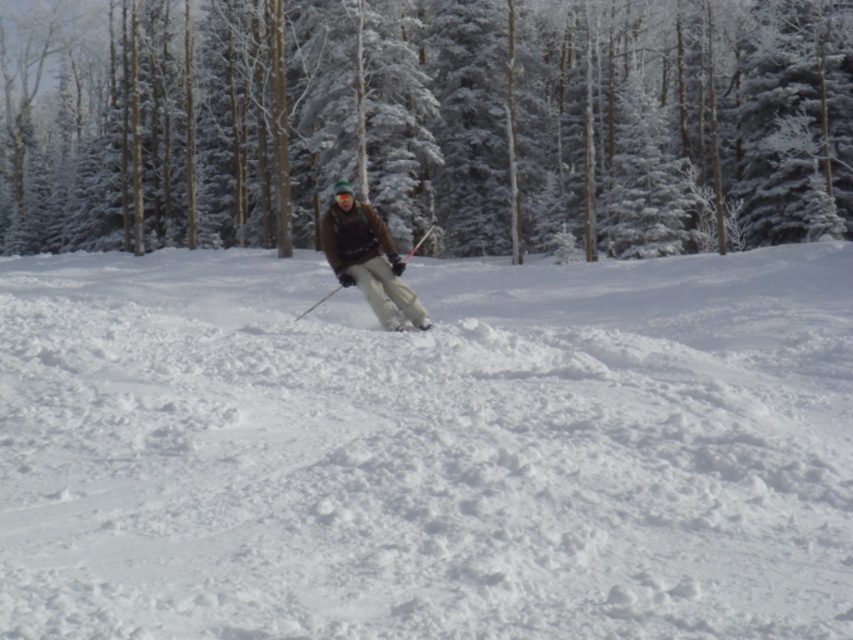
You are a skier trying to navigate through the snowy forest. You see the white fluffy snow at center and the snowy evergreen tree at center. Which one is directly above the other?

The snowy evergreen tree at center is directly above the white fluffy snow at center because the white fluffy snow at center is positioned under the snowy evergreen tree at center.

You are a skier who wants to know if your white matte ski at center can be fully covered by the white fluffy snow at center. Based on the scene, can it?

The white fluffy snow at center is larger in size than the white matte ski at center, so yes, the white fluffy snow at center can fully cover the white matte ski at center.

You are a skier who just arrived at the snowy area. You see the white fluffy snow at center and the white matte ski at center. Which one is taller?

The white fluffy snow at center is taller than the white matte ski at center.